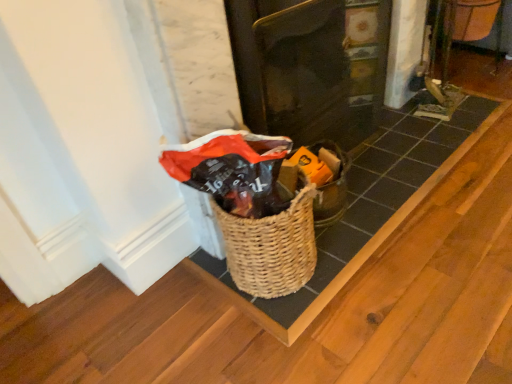
Question: Is there a large distance between woven wood basket at center and matte black door at center?

Choices:
 (A) yes
 (B) no

Answer: (B)

Question: Does woven wood basket at center have a greater width compared to matte black door at center?

Choices:
 (A) yes
 (B) no

Answer: (A)

Question: Considering the relative sizes of woven wood basket at center and matte black door at center in the image provided, is woven wood basket at center taller than matte black door at center?

Choices:
 (A) yes
 (B) no

Answer: (B)

Question: Does woven wood basket at center have a smaller size compared to matte black door at center?

Choices:
 (A) yes
 (B) no

Answer: (A)

Question: From a real-world perspective, is woven wood basket at center over matte black door at center?

Choices:
 (A) no
 (B) yes

Answer: (A)

Question: Would you say matte black door at center is to the left or to the right of woven wood basket at center in the picture?

Choices:
 (A) right
 (B) left

Answer: (B)

Question: Looking at their shapes, would you say matte black door at center is wider or thinner than woven wood basket at center?

Choices:
 (A) thin
 (B) wide

Answer: (A)

Question: From the image's perspective, is matte black door at center located above or below woven wood basket at center?

Choices:
 (A) below
 (B) above

Answer: (B)

Question: Is point (276, 46) positioned closer to the camera than point (327, 283)?

Choices:
 (A) closer
 (B) farther

Answer: (B)

Question: Is point pos(275,304) closer or farther from the camera than point pos(312,119)?

Choices:
 (A) farther
 (B) closer

Answer: (B)

Question: Based on their sizes in the image, would you say woven wood basket at center is bigger or smaller than matte black door at center?

Choices:
 (A) small
 (B) big

Answer: (A)

Question: From the image's perspective, is woven wood basket at center located above or below matte black door at center?

Choices:
 (A) above
 (B) below

Answer: (B)

Question: From their relative heights in the image, would you say woven wood basket at center is taller or shorter than matte black door at center?

Choices:
 (A) tall
 (B) short

Answer: (B)

Question: From a real-world perspective, is woven brown basket at center above or below woven wood basket at center?

Choices:
 (A) above
 (B) below

Answer: (A)

Question: Relative to woven wood basket at center, is woven brown basket at center in front or behind?

Choices:
 (A) behind
 (B) front

Answer: (B)